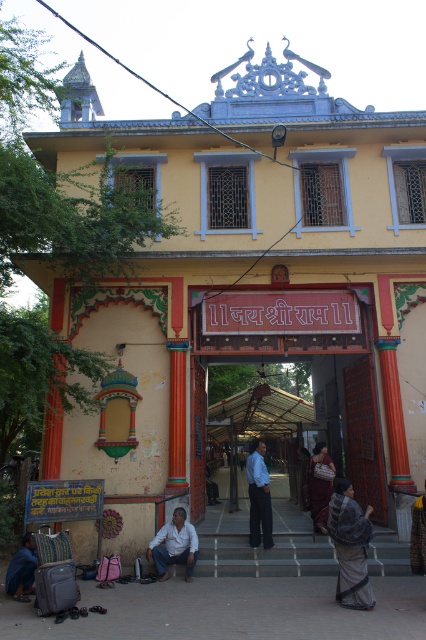
Is point (178, 548) closer to viewer compared to point (25, 550)?

No, it is not.

Is the position of white cotton shirt at lower center more distant than that of blue fabric at lower left?

Yes, white cotton shirt at lower center is behind blue fabric at lower left.

Identify the location of white cotton shirt at lower center. This screenshot has width=426, height=640. coord(173,545).

Which is above, light blue shirt at center or maroon fabric saree at center?

maroon fabric saree at center

Where is `light blue shirt at center`? This screenshot has width=426, height=640. light blue shirt at center is located at coordinates (259, 496).

At what (x,y) coordinates should I click in order to perform the action: click on light blue shirt at center. Please return your answer as a coordinate pair (x, y). This screenshot has width=426, height=640. Looking at the image, I should click on (259, 496).

Who is higher up, white cotton shirt at lower center or light blue shirt at center?

white cotton shirt at lower center is above.

Can you confirm if white cotton shirt at lower center is positioned above light blue shirt at center?

Indeed, white cotton shirt at lower center is positioned over light blue shirt at center.

Locate an element on the screen. The image size is (426, 640). white cotton shirt at lower center is located at coordinates pos(173,545).